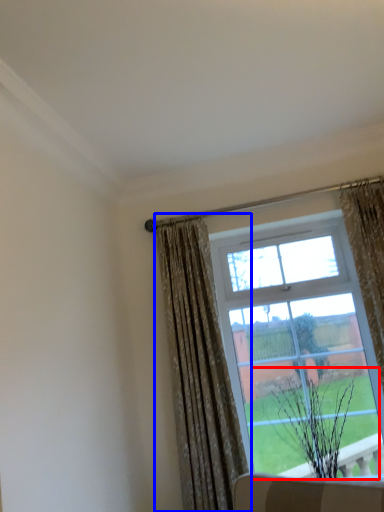
Question: Which object is closer to the camera taking this photo, plant (highlighted by a red box) or curtain (highlighted by a blue box)?

Choices:
 (A) plant
 (B) curtain

Answer: (B)